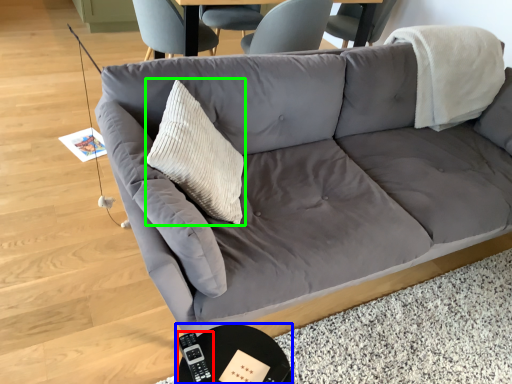
Question: Which is nearer to the remote (highlighted by a red box)? round table (highlighted by a blue box) or throw pillow (highlighted by a green box).

Choices:
 (A) round table
 (B) throw pillow

Answer: (A)